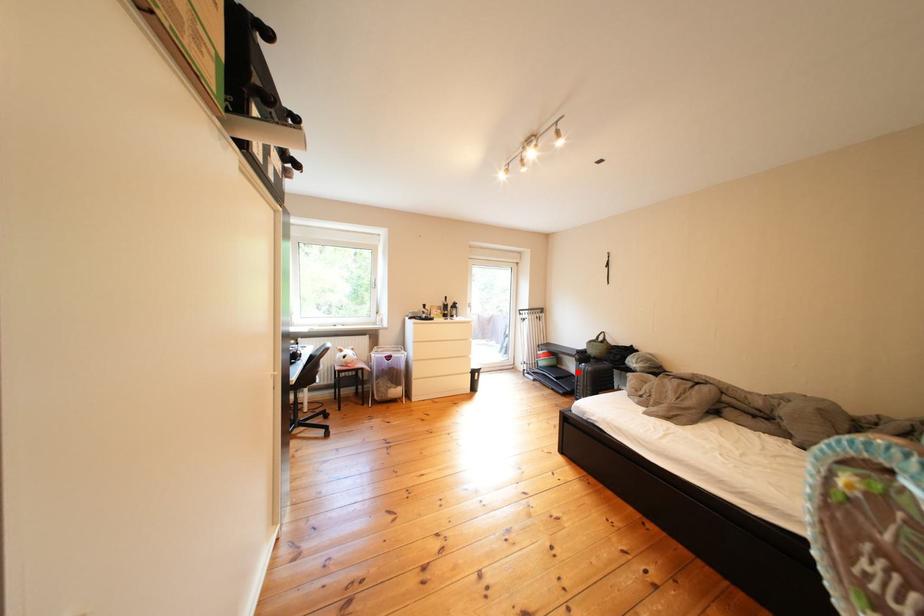
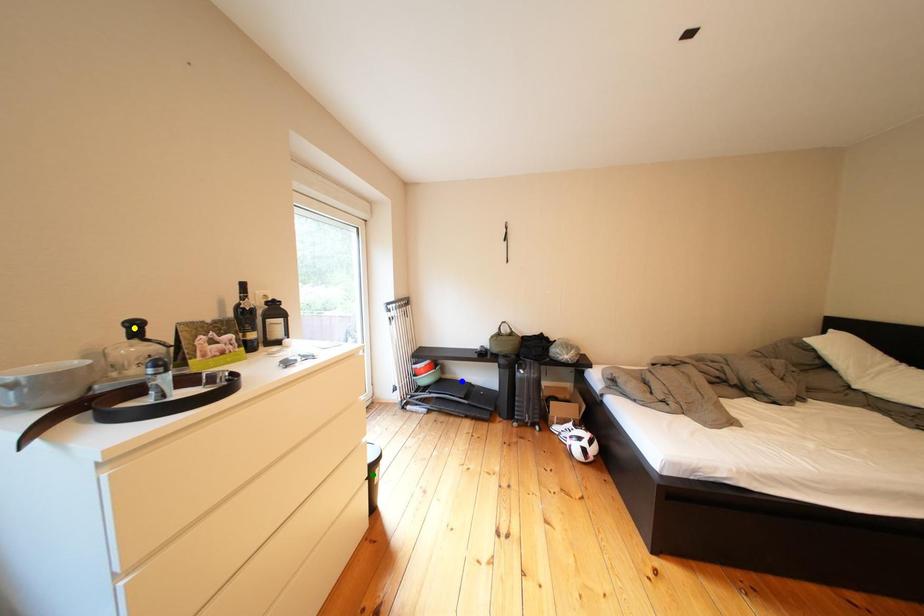
Question: I am providing you with two images of the same scene from different viewpoints. A red point is marked on the first image. You are given multiple points on the second image. Can you choose the point in image 2 that corresponds to the point in image 1?

Choices:
 (A) green point
 (B) blue point
 (C) yellow point

Answer: (B)